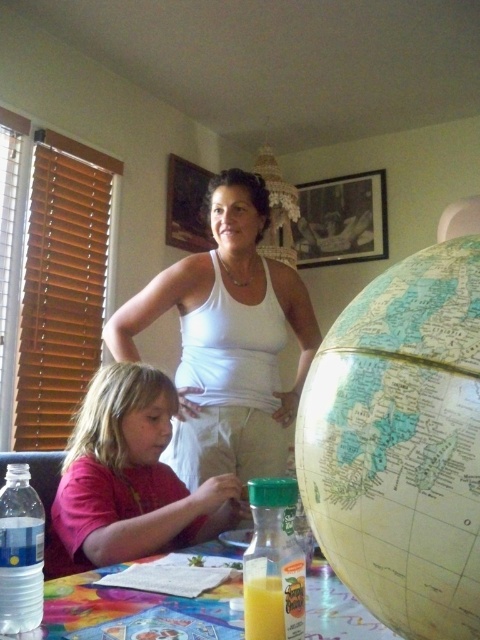
Question: Is pink fabric shirt at lower left further to camera compared to translucent plastic bottle of orange juice at table?

Choices:
 (A) yes
 (B) no

Answer: (A)

Question: Which object is farther from the camera taking this photo?

Choices:
 (A) pink fabric shirt at lower left
 (B) multicolored plastic table at lower center
 (C) white matte tank top at upper center
 (D) translucent plastic bottle of orange juice at table

Answer: (C)

Question: Is pink fabric shirt at lower left smaller than multicolored plastic table at lower center?

Choices:
 (A) no
 (B) yes

Answer: (A)

Question: Which of the following is the closest to the observer?

Choices:
 (A) multicolored plastic table at lower center
 (B) pink fabric shirt at lower left
 (C) translucent plastic bottle of orange juice at table

Answer: (C)

Question: Which point is farther to the camera?

Choices:
 (A) (207, 316)
 (B) (259, 582)
 (C) (103, 573)
 (D) (160, 428)

Answer: (A)

Question: Is pink fabric shirt at lower left to the right of multicolored plastic table at lower center from the viewer's perspective?

Choices:
 (A) yes
 (B) no

Answer: (B)